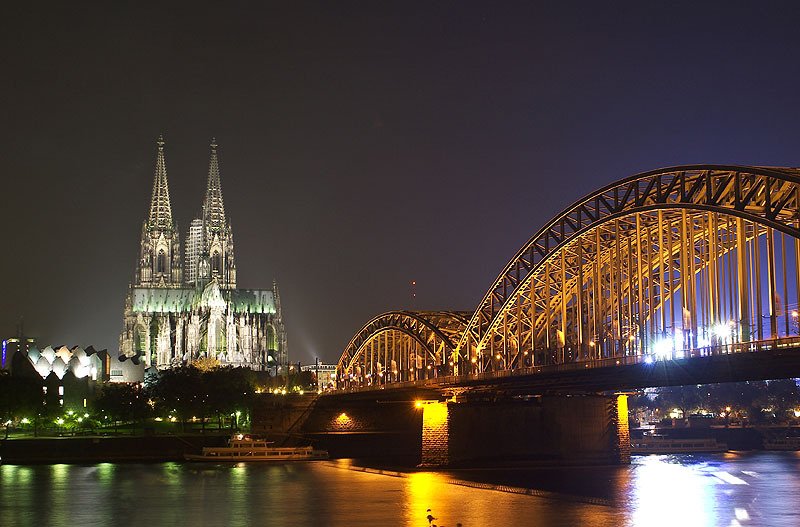
The height and width of the screenshot is (527, 800). In order to click on spotlight beam in this screenshot , I will do `click(313, 353)`.